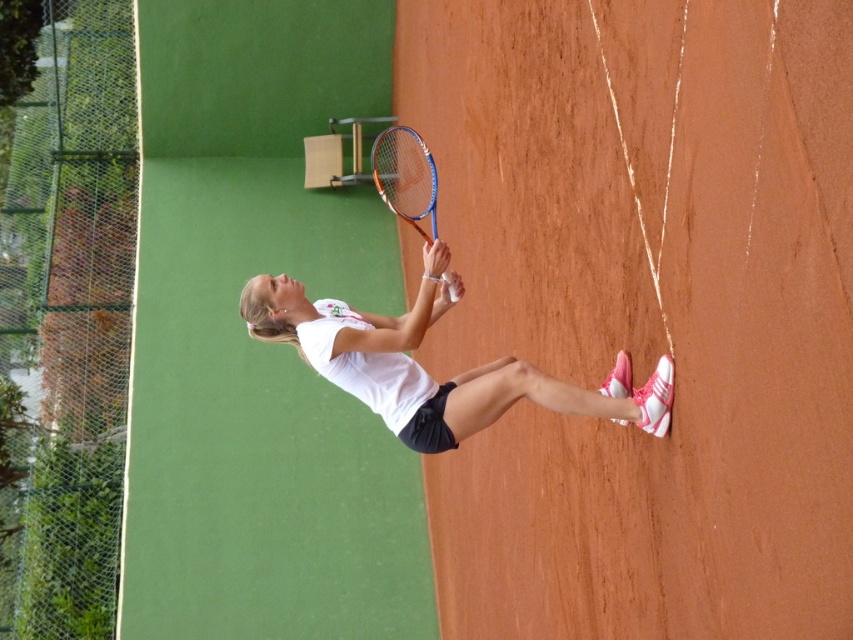
Can you confirm if white matte tennis racket at center is taller than orange metallic tennis racket at center?

Correct, white matte tennis racket at center is much taller as orange metallic tennis racket at center.

Who is more distant from viewer, (x=378, y=376) or (x=393, y=186)?

Point (x=393, y=186)

Locate an element on the screen. This screenshot has height=640, width=853. white matte tennis racket at center is located at coordinates (425, 371).